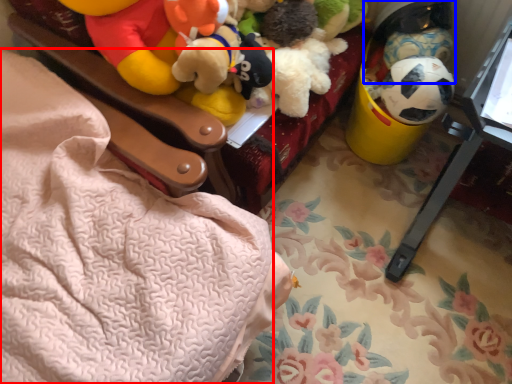
Question: Which of the following is the farthest to the observer, blanket (highlighted by a red box) or toy (highlighted by a blue box)?

Choices:
 (A) blanket
 (B) toy

Answer: (B)